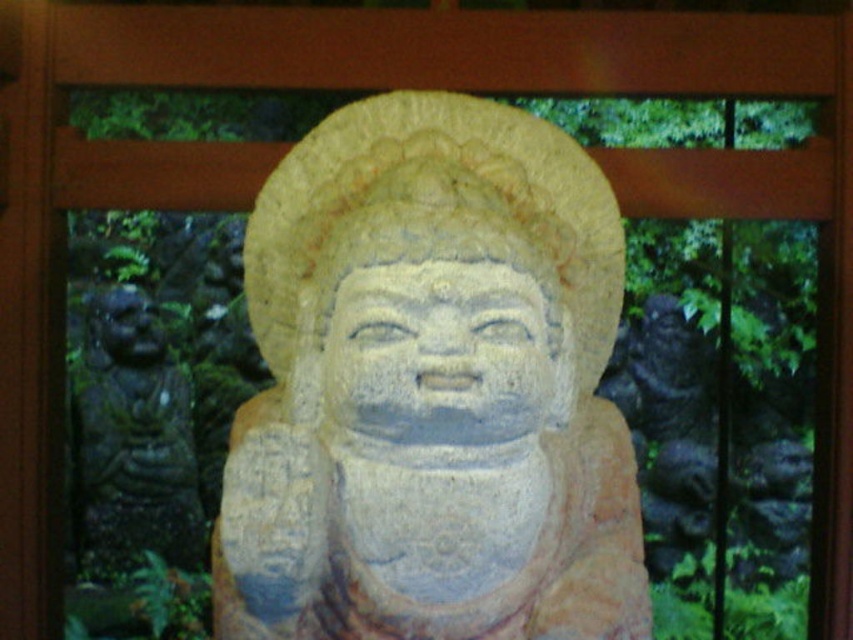
You are standing in front of a stone statue. You notice two statues described as smooth stone statue at center and yellow stone statue at center. Which one do you see first when looking directly ahead?

The smooth stone statue at center is closer to the viewer than the yellow stone statue at center, so you see the smooth stone statue at center first.

You are standing in front of a serene garden with a smooth stone statue at center. You want to place a small bouquet of flowers at your feet. If the bouquet is 1.5 feet wide, will it fit entirely in front of the statue without overlapping?

The smooth stone statue at center is 5.25 feet away from you. Since the bouquet is only 1.5 feet wide, there is enough space between you and the statue to place it without overlapping.

You are standing in front of the statue and want to place a small offering at a specific point marked at coordinates point (415, 512). If your arm reaches 5 feet, can you reach that point without moving closer?

The distance of point (415, 512) from viewer is 5.47 feet, so your arm can only reach 5 feet. Therefore, you cannot reach the point without moving closer.